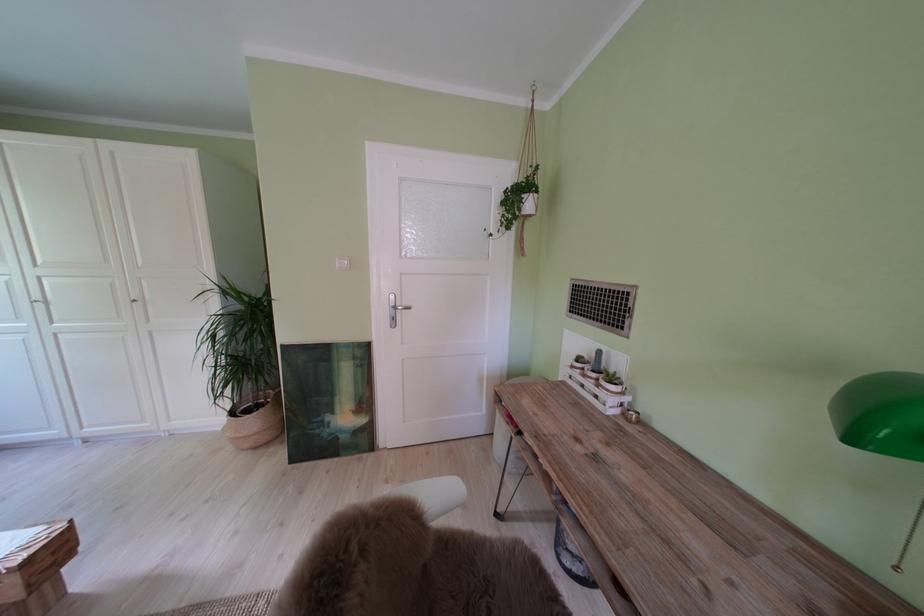
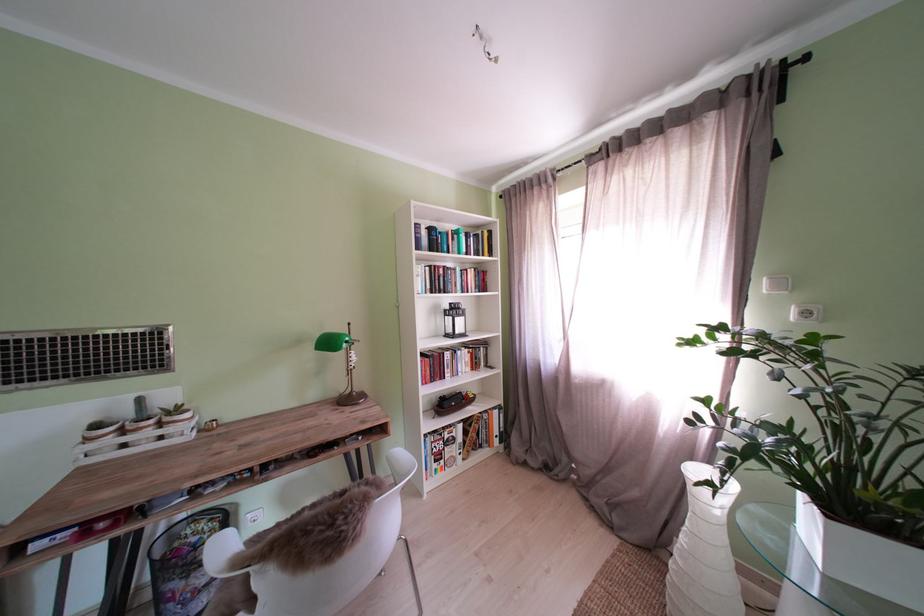
In the second image, find the point that corresponds to [604,381] in the first image.

(163, 427)